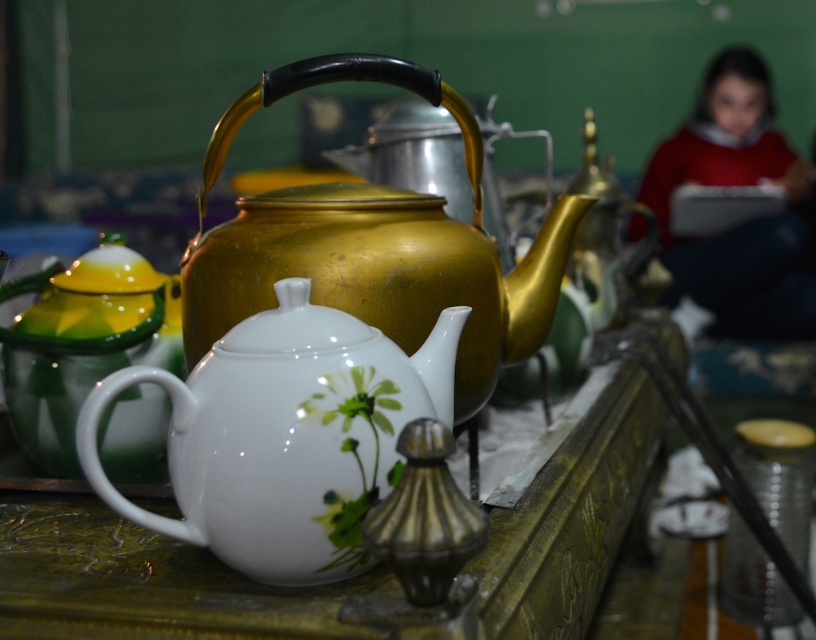
Question: Which point is closer to the camera taking this photo?

Choices:
 (A) (739, 179)
 (B) (364, 353)
 (C) (126, 324)
 (D) (489, 381)

Answer: (B)

Question: Considering the relative positions of gold metallic teapot at center and red sweater at upper right in the image provided, where is gold metallic teapot at center located with respect to red sweater at upper right?

Choices:
 (A) right
 (B) left

Answer: (B)

Question: Among these points, which one is farthest from the camera?

Choices:
 (A) click(x=482, y=328)
 (B) click(x=293, y=496)
 (C) click(x=80, y=376)
 (D) click(x=726, y=280)

Answer: (D)

Question: Can you confirm if white glossy teapot at center is positioned to the left of gold metallic teapot at center?

Choices:
 (A) no
 (B) yes

Answer: (B)

Question: Does white glossy teapot at center appear on the right side of green glossy teapot at left?

Choices:
 (A) no
 (B) yes

Answer: (B)

Question: Which is nearer to the gold metallic teapot at center?

Choices:
 (A) white glossy teapot at center
 (B) green glossy teapot at left

Answer: (A)